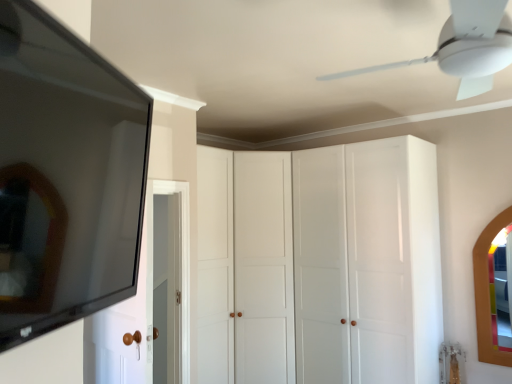
Question: In terms of height, does white glossy cabinet at center look taller or shorter compared to white wood door at left?

Choices:
 (A) short
 (B) tall

Answer: (B)

Question: Is white glossy cabinet at center wider or thinner than white wood door at left?

Choices:
 (A) wide
 (B) thin

Answer: (A)

Question: Which is farther from the white wood door at left?

Choices:
 (A) matte black mirror at left, which ranks as the first mirror in top-to-bottom order
 (B) white plastic ceiling fan at upper center
 (C) wooden-framed mirror at right, which appears as the second mirror when viewed from the top
 (D) white glossy cabinet at center

Answer: (C)

Question: Which object is positioned farthest from the white wood door at left?

Choices:
 (A) matte black mirror at left, the 2th mirror positioned from the bottom
 (B) white plastic ceiling fan at upper center
 (C) wooden-framed mirror at right, the 2th mirror viewed from the front
 (D) white glossy cabinet at center

Answer: (C)